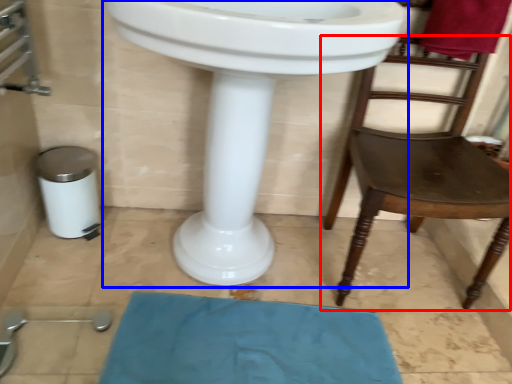
Question: Which object appears closest to the camera in this image, chair (highlighted by a red box) or sink (highlighted by a blue box)?

Choices:
 (A) chair
 (B) sink

Answer: (B)